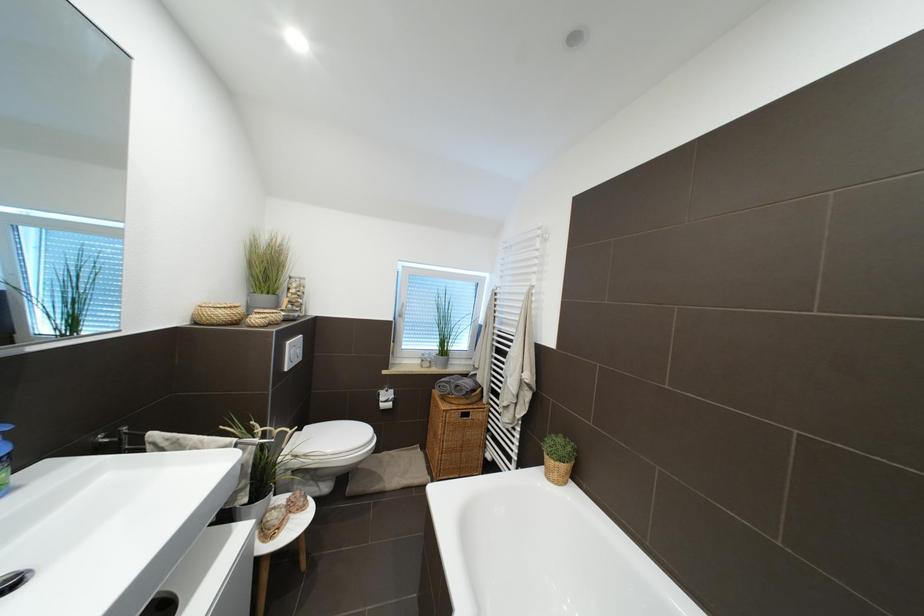
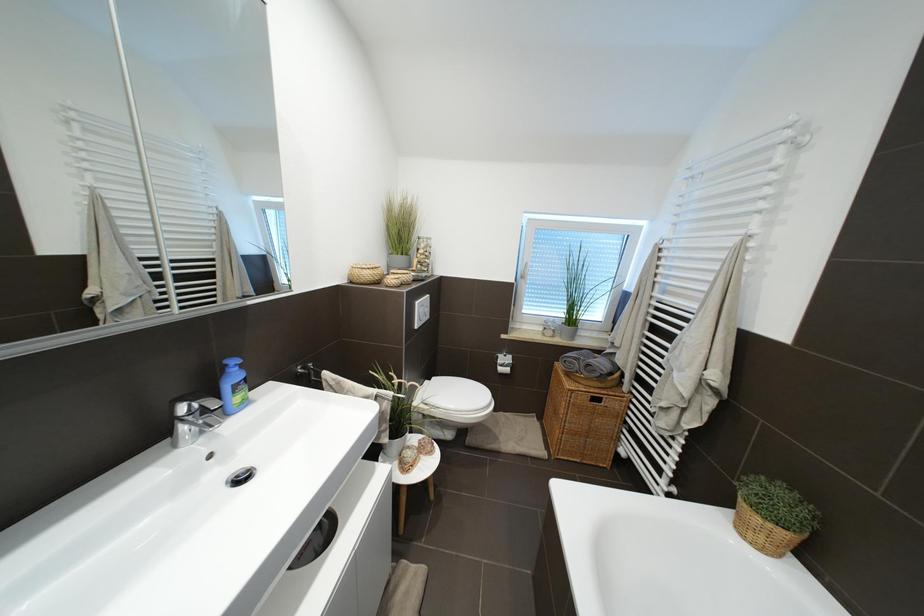
Question: The camera is either moving clockwise (left) or counter-clockwise (right) around the object. The first image is from the beginning of the video and the second image is from the end. Is the camera moving left or right when shooting the video?

Choices:
 (A) Left
 (B) Right

Answer: (B)